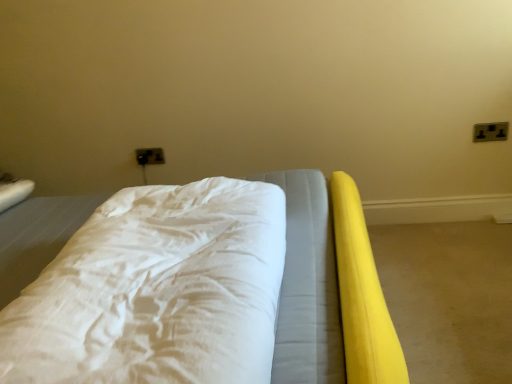
Question: From the image's perspective, is white soft bed at center beneath matte plastic outlet at upper center, which ranks as the second electric outlet in top-to-bottom order?

Choices:
 (A) no
 (B) yes

Answer: (B)

Question: Can you confirm if white soft bed at center is thinner than matte plastic outlet at upper center, the first electric outlet in the bottom-to-top sequence?

Choices:
 (A) no
 (B) yes

Answer: (A)

Question: Is white soft bed at center smaller than matte plastic outlet at upper center, which appears as the second electric outlet when viewed from the right?

Choices:
 (A) no
 (B) yes

Answer: (A)

Question: Is white soft bed at center to the left of matte plastic outlet at upper center, arranged as the second electric outlet when viewed from the front, from the viewer's perspective?

Choices:
 (A) yes
 (B) no

Answer: (B)

Question: Is white soft bed at center facing away from matte plastic outlet at upper center, arranged as the second electric outlet when viewed from the front?

Choices:
 (A) no
 (B) yes

Answer: (A)

Question: In the image, is matte plastic outlet at upper center, positioned as the 1th electric outlet in back-to-front order, positioned in front of or behind white soft bed at center?

Choices:
 (A) front
 (B) behind

Answer: (B)

Question: Is point (147, 152) positioned closer to the camera than point (57, 236)?

Choices:
 (A) closer
 (B) farther

Answer: (B)

Question: Is matte plastic outlet at upper center, the first electric outlet in the bottom-to-top sequence, spatially inside white soft bed at center, or outside of it?

Choices:
 (A) outside
 (B) inside

Answer: (A)

Question: From the image's perspective, is matte plastic outlet at upper center, which ranks as the second electric outlet in top-to-bottom order, above or below white soft bed at center?

Choices:
 (A) above
 (B) below

Answer: (A)

Question: In the image, is matte plastic outlet at upper center, which is the 1th electric outlet in left-to-right order, on the left side or the right side of yellow rubber mat at right?

Choices:
 (A) left
 (B) right

Answer: (A)

Question: Relative to yellow rubber mat at right, is matte plastic outlet at upper center, the first electric outlet in the bottom-to-top sequence, in front or behind?

Choices:
 (A) front
 (B) behind

Answer: (B)

Question: Considering the positions of matte plastic outlet at upper center, which is the 1th electric outlet in left-to-right order, and yellow rubber mat at right in the image, is matte plastic outlet at upper center, which is the 1th electric outlet in left-to-right order, wider or thinner than yellow rubber mat at right?

Choices:
 (A) thin
 (B) wide

Answer: (A)

Question: From the image's perspective, relative to yellow rubber mat at right, is matte plastic outlet at upper center, the first electric outlet in the bottom-to-top sequence, above or below?

Choices:
 (A) above
 (B) below

Answer: (A)

Question: Relative to white soft bed at center, is black plastic electric outlet at upper right, the second electric outlet when ordered from left to right, in front or behind?

Choices:
 (A) behind
 (B) front

Answer: (A)

Question: Based on their positions, is black plastic electric outlet at upper right, the second electric outlet when ordered from left to right, located to the left or right of white soft bed at center?

Choices:
 (A) left
 (B) right

Answer: (B)